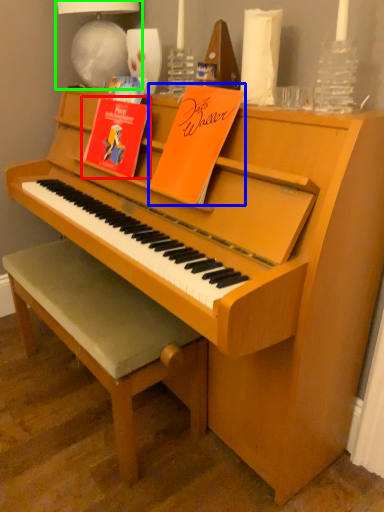
Question: Estimate the real-world distances between objects in this image. Which object is closer to paperback book (highlighted by a red box), paperback book (highlighted by a blue box) or lamp (highlighted by a green box)?

Choices:
 (A) paperback book
 (B) lamp

Answer: (A)